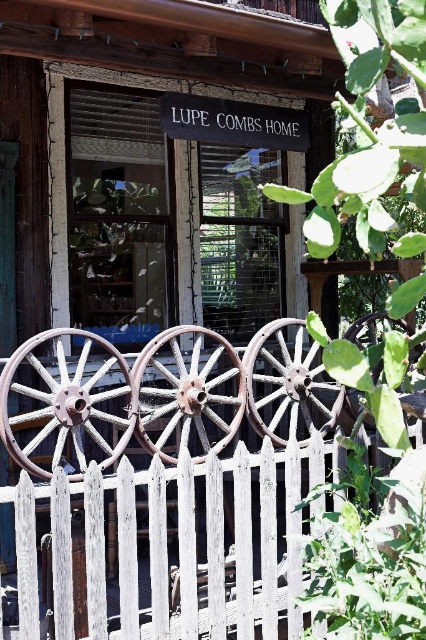
You are standing in front of the house and want to touch the rusty metal wagon wheel at lower left and the rusty metal wheel at center. Which one would you reach first?

You would reach the rusty metal wagon wheel at lower left first because it is closer to you than the rusty metal wheel at center, which is further away.

You are a delivery person trying to decide which wagon wheel to use for a restoration project. The rusty metal wagon wheel at lower left and the rusty metal wheel at center are both available. Which one should you choose if you need a larger size?

The rusty metal wheel at center is larger than the rusty metal wagon wheel at lower left, so you should choose the rusty metal wheel at center for the restoration project.

You are standing in front of the rustic wooden structure labeled as LUPE COMBS HOME. You notice a point marked at coordinates (178, 545). Based on the scene description, what object is located at that point?

The point at coordinates (178, 545) indicates the location of the white wooden picket fence at center.